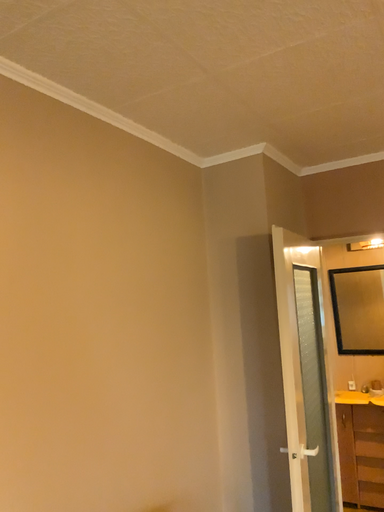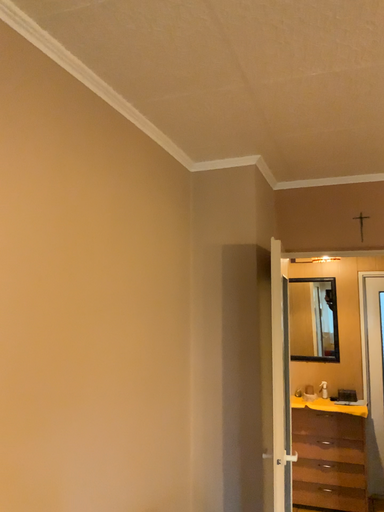
Question: Which way did the camera rotate in the video?

Choices:
 (A) rotated left
 (B) rotated right

Answer: (B)